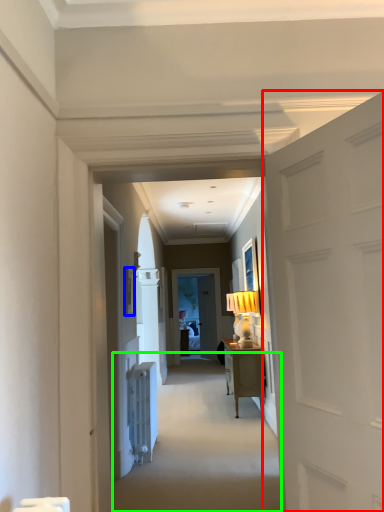
Question: Considering the real-world distances, which object is farthest from door (highlighted by a red box)? picture frame (highlighted by a blue box) or path (highlighted by a green box)?

Choices:
 (A) picture frame
 (B) path

Answer: (A)